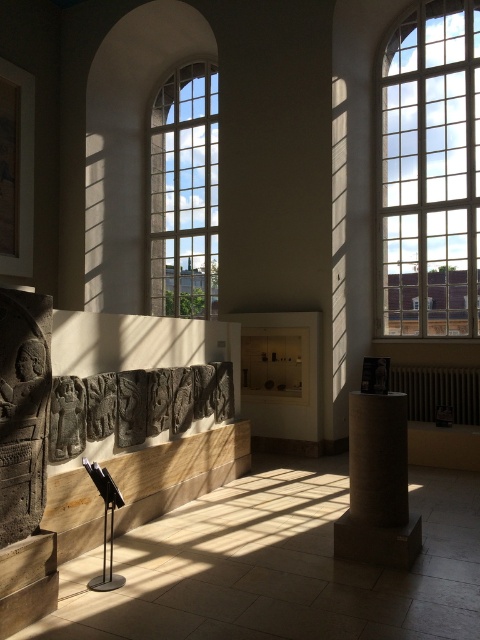
You are a visitor in the museum and want to take a photo of both the clear glass window at center and the dark gray stone carving at center. Which object should you position yourself closer to in order to capture both in a single frame?

You should position yourself closer to the dark gray stone carving at center because the clear glass window at center is to the right of it, allowing both objects to be included in the frame when centered on the carving.

You are standing in the museum and want to take a photo of the clear glass window at upper right through your camera lens. Your camera has a maximum focus range of 8 meters. Will the window be in focus?

The clear glass window at upper right is 8.40 meters from viewer, which exceeds the camera lens maximum focus range of 8 meters. Therefore, the window will not be in focus.

You are an art conservator tasked with cleaning the matte stone column at center and the dark gray stone carving at center. Which object should you clean first if you want to start from the bottom and work your way up?

You should clean the matte stone column at center first because it is located below the dark gray stone carving at center, allowing you to work from the bottom upward.